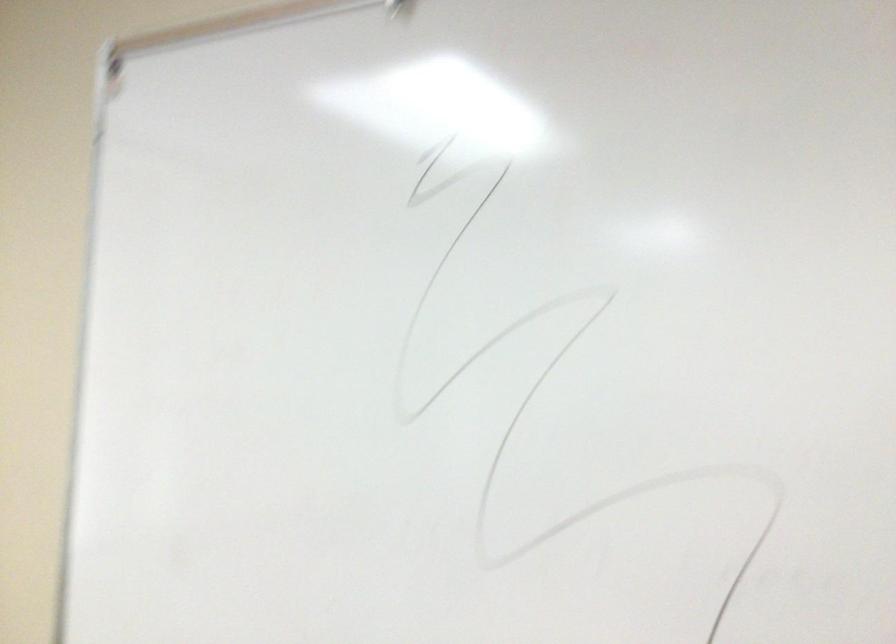
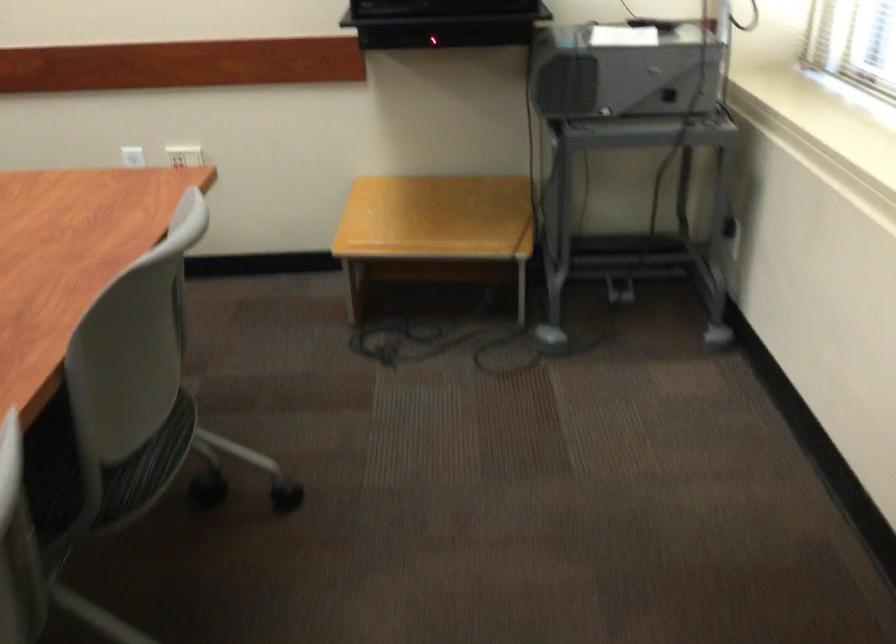
Question: In a continuous first-person perspective shot, in which direction is the camera moving?

Choices:
 (A) Left
 (B) Right
 (C) Forward
 (D) Backward

Answer: (D)